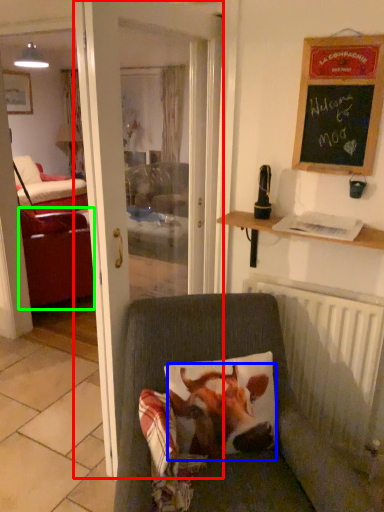
Question: Which is farther away from door (highlighted by a red box)? cattle (highlighted by a blue box) or studio couch (highlighted by a green box)?

Choices:
 (A) cattle
 (B) studio couch

Answer: (B)